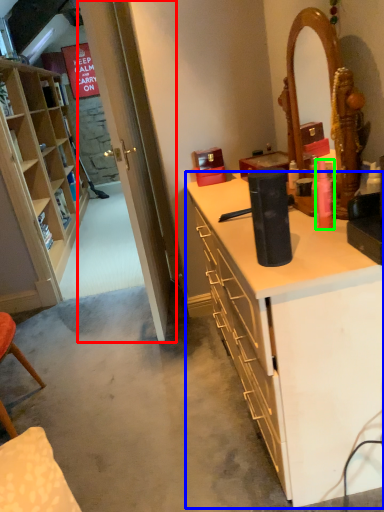
Question: Considering the real-world distances, which object is closest to glass door (highlighted by a red box)? desk (highlighted by a blue box) or toiletry (highlighted by a green box).

Choices:
 (A) desk
 (B) toiletry

Answer: (A)